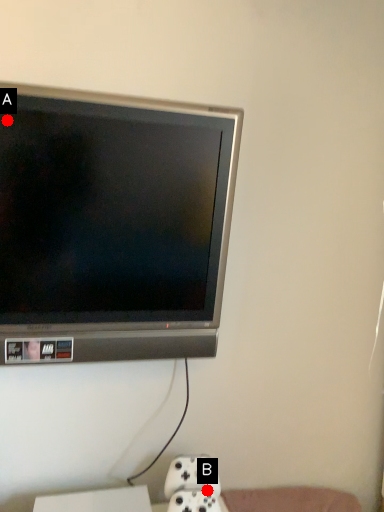
Question: Two points are circled on the image, labeled by A and B beside each circle. Which point is closer to the camera?

Choices:
 (A) A is closer
 (B) B is closer

Answer: (A)